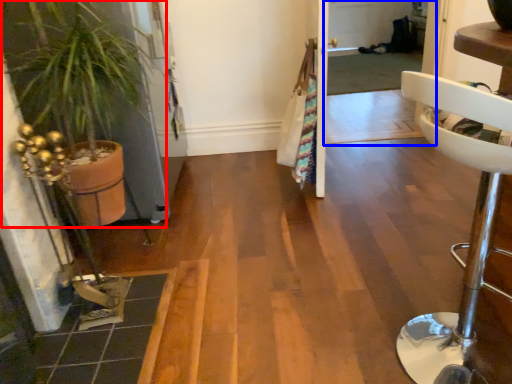
Question: Which object appears closest to the camera in this image, houseplant (highlighted by a red box) or screen door (highlighted by a blue box)?

Choices:
 (A) houseplant
 (B) screen door

Answer: (A)